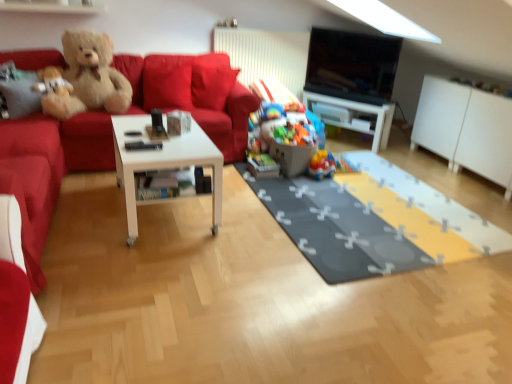
Find the location of a particular element. The image size is (512, 384). vacant region in front of matte plastic toy at center, which ranks as the 3th toy in right-to-left order is located at coordinates [x=271, y=181].